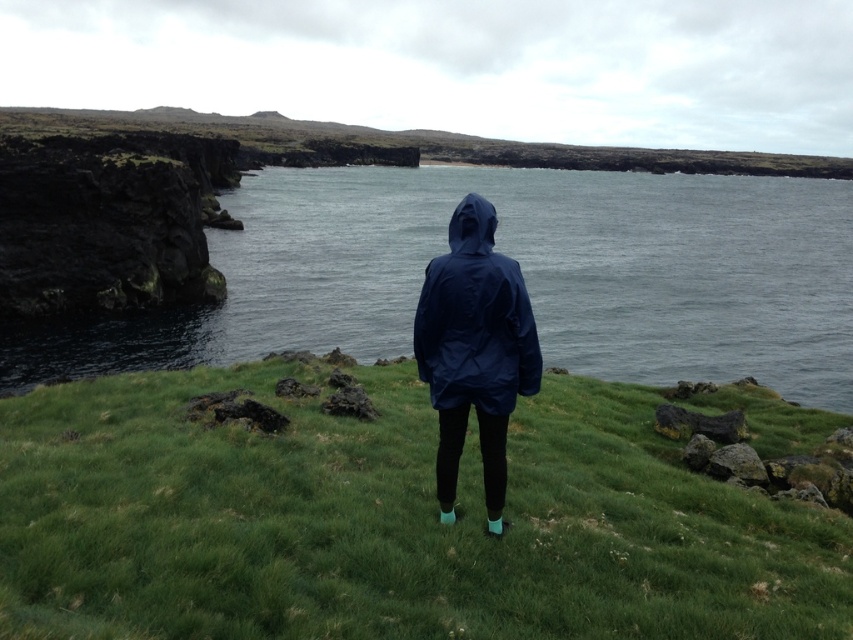
Question: Which is farther from the green grassy at center?

Choices:
 (A) smooth gray water at center
 (B) navy blue waterproof jacket at center

Answer: (A)

Question: Based on their relative distances, which object is nearer to the blue matte hood at center?

Choices:
 (A) green grassy at center
 (B) smooth gray water at center
 (C) navy blue waterproof jacket at center

Answer: (C)

Question: Is smooth gray water at center thinner than navy blue waterproof jacket at center?

Choices:
 (A) yes
 (B) no

Answer: (B)

Question: Which point appears closest to the camera in this image?

Choices:
 (A) (531, 388)
 (B) (83, 355)
 (C) (477, 205)

Answer: (A)

Question: Does green grassy at center have a larger size compared to smooth gray water at center?

Choices:
 (A) no
 (B) yes

Answer: (A)

Question: Is green grassy at center thinner than navy blue waterproof jacket at center?

Choices:
 (A) yes
 (B) no

Answer: (B)